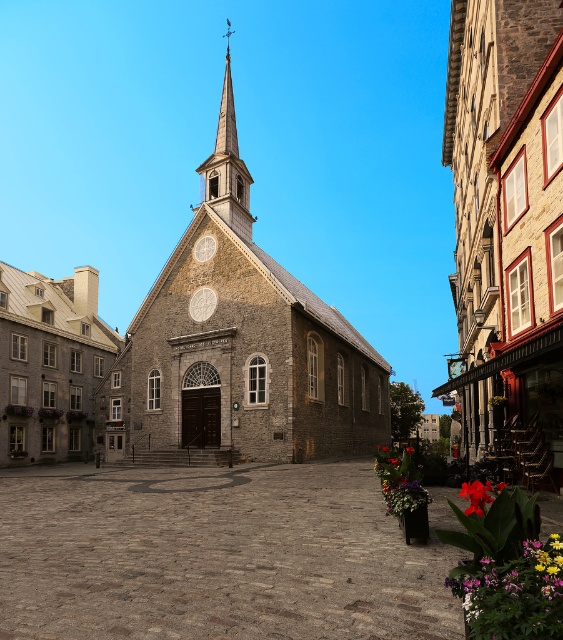
Which is behind, point (449, 67) or point (227, 124)?

The point (227, 124) is behind.

Is point (538, 168) more distant than point (242, 211)?

No, it is not.

Who is more distant from viewer, (x=498, y=193) or (x=217, y=189)?

Positioned behind is point (x=217, y=189).

Find the location of a particular element. The height and width of the screenshot is (640, 563). stone church at center is located at coordinates (507, 225).

Does vibrant floral bouquet at lower right have a lesser height compared to vivid red petals at center?

Indeed, vibrant floral bouquet at lower right has a lesser height compared to vivid red petals at center.

Is vibrant floral bouquet at lower right positioned in front of vivid red petals at center?

Yes, vibrant floral bouquet at lower right is in front of vivid red petals at center.

Find the location of a particular element. Image resolution: width=563 pixels, height=640 pixels. vibrant floral bouquet at lower right is located at coordinates (399, 481).

Is stone church at center above vivid red petals at center?

Yes, stone church at center is above vivid red petals at center.

Can you confirm if stone church at center is smaller than vivid red petals at center?

No, stone church at center is not smaller than vivid red petals at center.

Does point (498, 115) lie behind point (413, 449)?

No.

Identify the location of stone church at center. Image resolution: width=563 pixels, height=640 pixels. pos(507,225).